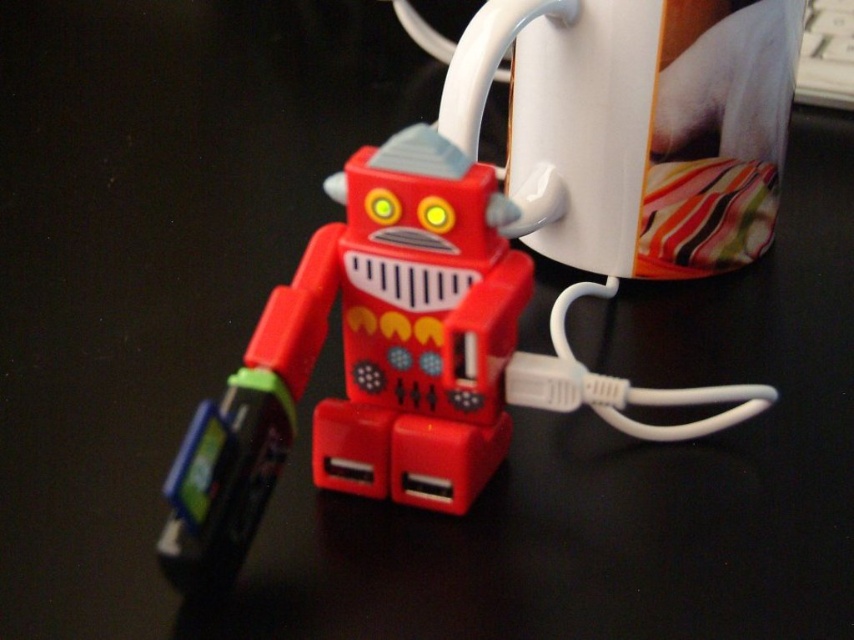
Question: From the image, what is the correct spatial relationship of rubberized plastic robot at center in relation to white glossy mug at upper center?

Choices:
 (A) below
 (B) above

Answer: (A)

Question: Where is rubberized plastic robot at center located in relation to white glossy mug at upper center in the image?

Choices:
 (A) left
 (B) right

Answer: (A)

Question: Which point is closer to the camera taking this photo?

Choices:
 (A) (588, 116)
 (B) (294, 330)

Answer: (B)

Question: Is rubberized plastic robot at center thinner than white glossy mug at upper center?

Choices:
 (A) yes
 (B) no

Answer: (A)